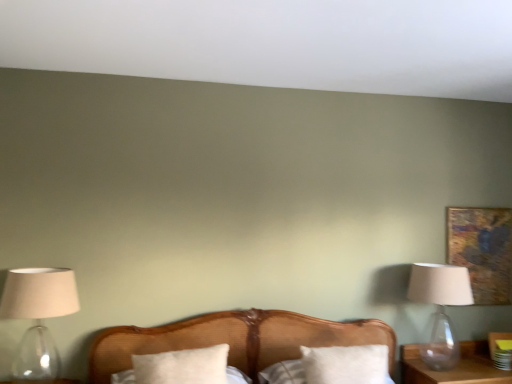
The width and height of the screenshot is (512, 384). Describe the element at coordinates (234, 339) in the screenshot. I see `wooden bed at center` at that location.

Locate an element on the screen. The image size is (512, 384). wooden bed at center is located at coordinates (234, 339).

Locate an element on the screen. white soft pillow at center, the second pillow positioned from the left is located at coordinates (346, 364).

The height and width of the screenshot is (384, 512). In order to click on gold textured painting at upper right in this screenshot , I will do `click(482, 250)`.

Is point (426, 264) more distant than point (485, 298)?

No.

Looking at the image, does transparent glass lamp at right, the 2th lamp in the front-to-back sequence, seem bigger or smaller compared to gold textured painting at upper right?

Clearly, transparent glass lamp at right, the 2th lamp in the front-to-back sequence, is larger in size than gold textured painting at upper right.

Between transparent glass lamp at right, the second lamp in the left-to-right sequence, and gold textured painting at upper right, which one has larger width?

With larger width is transparent glass lamp at right, the second lamp in the left-to-right sequence.

Which object is positioned more to the left, white soft pillow at center, the second pillow positioned from the left, or translucent glass lampshade at left, which is counted as the first lamp, starting from the left?

translucent glass lampshade at left, which is counted as the first lamp, starting from the left.

Is white soft pillow at center, the second pillow positioned from the left, with translucent glass lampshade at left, the 2th lamp positioned from the back?

No, white soft pillow at center, the second pillow positioned from the left, is not touching translucent glass lampshade at left, the 2th lamp positioned from the back.

Based on the photo, is white soft pillow at center, the 1th pillow viewed from the right, shorter than translucent glass lampshade at left, which is counted as the first lamp, starting from the left?

Yes.

From a real-world perspective, between transparent glass lamp at right, the second lamp in the left-to-right sequence, and white soft pillow at center, which is the first pillow in left-to-right order, who is vertically lower?

white soft pillow at center, which is the first pillow in left-to-right order.

Is transparent glass lamp at right, which is counted as the 1th lamp, starting from the right, inside the boundaries of white soft pillow at center, which appears as the 2th pillow when viewed from the right, or outside?

transparent glass lamp at right, which is counted as the 1th lamp, starting from the right, is not inside white soft pillow at center, which appears as the 2th pillow when viewed from the right, it's outside.

Can you confirm if transparent glass lamp at right, the second lamp in the left-to-right sequence, is taller than white soft pillow at center, which appears as the 2th pillow when viewed from the right?

Yes, transparent glass lamp at right, the second lamp in the left-to-right sequence, is taller than white soft pillow at center, which appears as the 2th pillow when viewed from the right.

How much distance is there between transparent glass lamp at right, acting as the 1th lamp starting from the back, and white soft pillow at center, which appears as the 2th pillow when viewed from the right?

They are 5.15 feet apart.

Is the position of translucent glass lampshade at left, the second lamp viewed from the right, more distant than that of wooden bed at center?

Yes, the depth of translucent glass lampshade at left, the second lamp viewed from the right, is greater than that of wooden bed at center.

From the image's perspective, between translucent glass lampshade at left, the second lamp viewed from the right, and wooden bed at center, which one is located above?

translucent glass lampshade at left, the second lamp viewed from the right, appears higher in the image.

Is translucent glass lampshade at left, the 2th lamp positioned from the back, turned away from wooden bed at center?

translucent glass lampshade at left, the 2th lamp positioned from the back, is not turned away from wooden bed at center.

How different are the orientations of gold textured painting at upper right and white soft pillow at center, the second pillow positioned from the left, in degrees?

There is a 2.52-degree angle between the facing directions of gold textured painting at upper right and white soft pillow at center, the second pillow positioned from the left.

From a real-world perspective, which object stands above the other?

gold textured painting at upper right, from a real-world perspective.

Does gold textured painting at upper right lie behind white soft pillow at center, the 1th pillow viewed from the right?

Yes, gold textured painting at upper right is further from the camera.

Is gold textured painting at upper right facing away from white soft pillow at center, the second pillow positioned from the left?

gold textured painting at upper right does not have its back to white soft pillow at center, the second pillow positioned from the left.

Which is in front, point (218, 352) or point (465, 280)?

The point (218, 352) is closer to the camera.

In the scene shown: Considering the sizes of white soft pillow at center, which is the first pillow in left-to-right order, and transparent glass lamp at right, which is counted as the 1th lamp, starting from the right, in the image, is white soft pillow at center, which is the first pillow in left-to-right order, taller or shorter than transparent glass lamp at right, which is counted as the 1th lamp, starting from the right,?

white soft pillow at center, which is the first pillow in left-to-right order, is shorter than transparent glass lamp at right, which is counted as the 1th lamp, starting from the right.

Based on the photo, is white soft pillow at center, which is the first pillow in left-to-right order, inside or outside of transparent glass lamp at right, the second lamp in the left-to-right sequence?

white soft pillow at center, which is the first pillow in left-to-right order, is located beyond the bounds of transparent glass lamp at right, the second lamp in the left-to-right sequence.

Is white soft pillow at center, which is the first pillow in left-to-right order, next to transparent glass lamp at right, which is counted as the 1th lamp, starting from the right?

white soft pillow at center, which is the first pillow in left-to-right order, and transparent glass lamp at right, which is counted as the 1th lamp, starting from the right, are clearly separated.

Are transparent glass lamp at right, which is counted as the 1th lamp, starting from the right, and translucent glass lampshade at left, which is counted as the first lamp, starting from the left, far apart?

transparent glass lamp at right, which is counted as the 1th lamp, starting from the right, is far away from translucent glass lampshade at left, which is counted as the first lamp, starting from the left.

In terms of size, does transparent glass lamp at right, which is counted as the 1th lamp, starting from the right, appear bigger or smaller than translucent glass lampshade at left, the 1th lamp positioned from the front?

Considering their sizes, transparent glass lamp at right, which is counted as the 1th lamp, starting from the right, takes up less space than translucent glass lampshade at left, the 1th lamp positioned from the front.

Consider the image. Is transparent glass lamp at right, acting as the 1th lamp starting from the back, in front of or behind translucent glass lampshade at left, the second lamp viewed from the right, in the image?

In the image, transparent glass lamp at right, acting as the 1th lamp starting from the back, appears behind translucent glass lampshade at left, the second lamp viewed from the right.

The width and height of the screenshot is (512, 384). Find the location of `lamp that appears on the right of translucent glass lampshade at left, the second lamp viewed from the right`. lamp that appears on the right of translucent glass lampshade at left, the second lamp viewed from the right is located at coordinates (439, 309).

Find the location of a particular element. The height and width of the screenshot is (384, 512). the 1st lamp in front of the gold textured painting at upper right is located at coordinates (439, 309).

Locate an element on the screen. The image size is (512, 384). lamp that is the 2nd object above the white soft pillow at center, the second pillow positioned from the left (from a real-world perspective) is located at coordinates (38, 317).

When comparing their distances from white soft pillow at center, which is the first pillow in left-to-right order, does white soft pillow at center, the 1th pillow viewed from the right, or translucent glass lampshade at left, the 2th lamp positioned from the back, seem further?

translucent glass lampshade at left, the 2th lamp positioned from the back, lies further to white soft pillow at center, which is the first pillow in left-to-right order, than the other object.

From the image, which object appears to be farther from white soft pillow at center, the second pillow positioned from the left, wooden bed at center or translucent glass lampshade at left, which is counted as the first lamp, starting from the left?

translucent glass lampshade at left, which is counted as the first lamp, starting from the left, is positioned further to the anchor white soft pillow at center, the second pillow positioned from the left.

Based on their spatial positions, is translucent glass lampshade at left, the 2th lamp positioned from the back, or gold textured painting at upper right further from white soft pillow at center, which is the first pillow in left-to-right order?

Among the two, gold textured painting at upper right is located further to white soft pillow at center, which is the first pillow in left-to-right order.

Looking at the image, which one is located further to white soft pillow at center, the second pillow positioned from the left, translucent glass lampshade at left, the second lamp viewed from the right, or white soft pillow at center, which appears as the 2th pillow when viewed from the right?

translucent glass lampshade at left, the second lamp viewed from the right, is further to white soft pillow at center, the second pillow positioned from the left.

Estimate the real-world distances between objects in this image. Which object is further from wooden bed at center, translucent glass lampshade at left, the second lamp viewed from the right, or white soft pillow at center, which appears as the 2th pillow when viewed from the right?

translucent glass lampshade at left, the second lamp viewed from the right.

Which object lies nearer to the anchor point transparent glass lamp at right, which is counted as the 1th lamp, starting from the right, white soft pillow at center, which is the first pillow in left-to-right order, or translucent glass lampshade at left, the 2th lamp positioned from the back?

Among the two, white soft pillow at center, which is the first pillow in left-to-right order, is located nearer to transparent glass lamp at right, which is counted as the 1th lamp, starting from the right.

From the picture: From the image, which object appears to be farther from white soft pillow at center, the second pillow positioned from the left, gold textured painting at upper right or transparent glass lamp at right, the 2th lamp in the front-to-back sequence?

Among the two, gold textured painting at upper right is located further to white soft pillow at center, the second pillow positioned from the left.

Which object lies nearer to the anchor point white soft pillow at center, which appears as the 2th pillow when viewed from the right, transparent glass lamp at right, acting as the 1th lamp starting from the back, or gold textured painting at upper right?

transparent glass lamp at right, acting as the 1th lamp starting from the back.

You are a GUI agent. You are given a task and a screenshot of the screen. Output one action in this format:
    pyautogui.click(x=<x>, y=<y>)
    Task: Click on the pillow between white soft pillow at center, which appears as the 2th pillow when viewed from the right, and transparent glass lamp at right, acting as the 1th lamp starting from the back, in the horizontal direction
    The image size is (512, 384).
    Given the screenshot: What is the action you would take?
    pyautogui.click(x=346, y=364)

Where is `lamp between white soft pillow at center, which appears as the 2th pillow when viewed from the right, and gold textured painting at upper right`? The height and width of the screenshot is (384, 512). lamp between white soft pillow at center, which appears as the 2th pillow when viewed from the right, and gold textured painting at upper right is located at coordinates (439, 309).

This screenshot has height=384, width=512. I want to click on bed between white soft pillow at center, which appears as the 2th pillow when viewed from the right, and gold textured painting at upper right, so click(x=234, y=339).

Find the location of a particular element. Image resolution: width=512 pixels, height=384 pixels. lamp located between translucent glass lampshade at left, the 2th lamp positioned from the back, and gold textured painting at upper right in the left-right direction is located at coordinates [x=439, y=309].